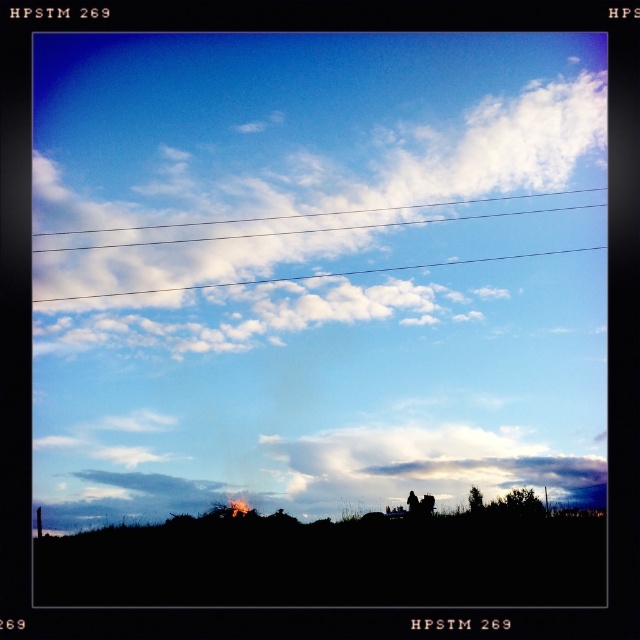
Question: Is white fluffy cloud at upper center smaller than brushed metal telegraph pole at lower left?

Choices:
 (A) no
 (B) yes

Answer: (A)

Question: Among these points, which one is farthest from the camera?

Choices:
 (A) (36, 534)
 (B) (168, 288)
 (C) (433, 513)

Answer: (B)

Question: Estimate the real-world distances between objects in this image. Which object is closer to the brushed metal telegraph pole at lower left?

Choices:
 (A) white fluffy cloud at upper center
 (B) black matte hillside at lower center

Answer: (B)

Question: Considering the real-world distances, which object is closest to the brushed metal telegraph pole at lower left?

Choices:
 (A) white fluffy cloud at upper center
 (B) black matte hillside at lower center

Answer: (B)

Question: Does white fluffy cloud at upper center appear under brushed metal telegraph pole at lower left?

Choices:
 (A) no
 (B) yes

Answer: (A)

Question: Does white fluffy cloud at upper center lie behind brushed metal telegraph pole at lower left?

Choices:
 (A) no
 (B) yes

Answer: (B)